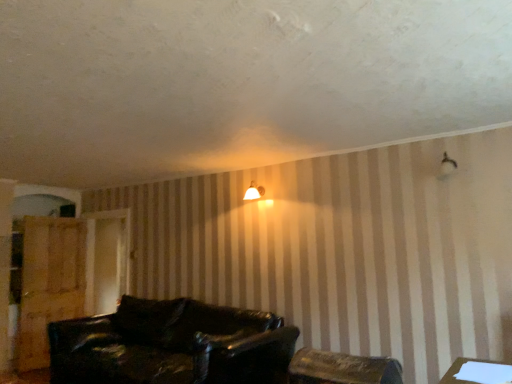
Question: Are wooden chair at lower center and leather couch at lower center far apart?

Choices:
 (A) no
 (B) yes

Answer: (B)

Question: Is the depth of wooden chair at lower center less than that of leather couch at lower center?

Choices:
 (A) yes
 (B) no

Answer: (A)

Question: Is wooden chair at lower center to the left of leather couch at lower center from the viewer's perspective?

Choices:
 (A) no
 (B) yes

Answer: (A)

Question: From the image's perspective, is wooden chair at lower center over leather couch at lower center?

Choices:
 (A) no
 (B) yes

Answer: (B)

Question: Is wooden chair at lower center facing towards leather couch at lower center?

Choices:
 (A) yes
 (B) no

Answer: (B)

Question: Is point (250, 183) closer or farther from the camera than point (391, 377)?

Choices:
 (A) farther
 (B) closer

Answer: (A)

Question: Is matte white lampshade at upper center bigger or smaller than wooden chair at lower center?

Choices:
 (A) small
 (B) big

Answer: (A)

Question: Is matte white lampshade at upper center inside or outside of wooden chair at lower center?

Choices:
 (A) outside
 (B) inside

Answer: (A)

Question: Is matte white lampshade at upper center taller or shorter than wooden chair at lower center?

Choices:
 (A) short
 (B) tall

Answer: (A)

Question: From a real-world perspective, is wooden dresser at left physically located above or below leather couch at lower center?

Choices:
 (A) below
 (B) above

Answer: (B)

Question: From the image's perspective, is wooden dresser at left above or below leather couch at lower center?

Choices:
 (A) below
 (B) above

Answer: (B)

Question: In the image, is wooden dresser at left on the left side or the right side of leather couch at lower center?

Choices:
 (A) right
 (B) left

Answer: (B)

Question: Do you think wooden dresser at left is within leather couch at lower center, or outside of it?

Choices:
 (A) outside
 (B) inside

Answer: (A)

Question: Looking at their shapes, would you say white paper at lower right is wider or thinner than wooden chair at lower center?

Choices:
 (A) wide
 (B) thin

Answer: (B)

Question: Looking at the image, does white paper at lower right seem bigger or smaller compared to wooden chair at lower center?

Choices:
 (A) small
 (B) big

Answer: (A)